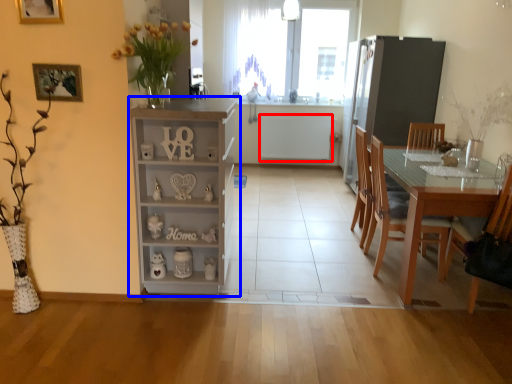
Question: Which object appears closest to the camera in this image, appliance (highlighted by a red box) or cabinetry (highlighted by a blue box)?

Choices:
 (A) appliance
 (B) cabinetry

Answer: (B)